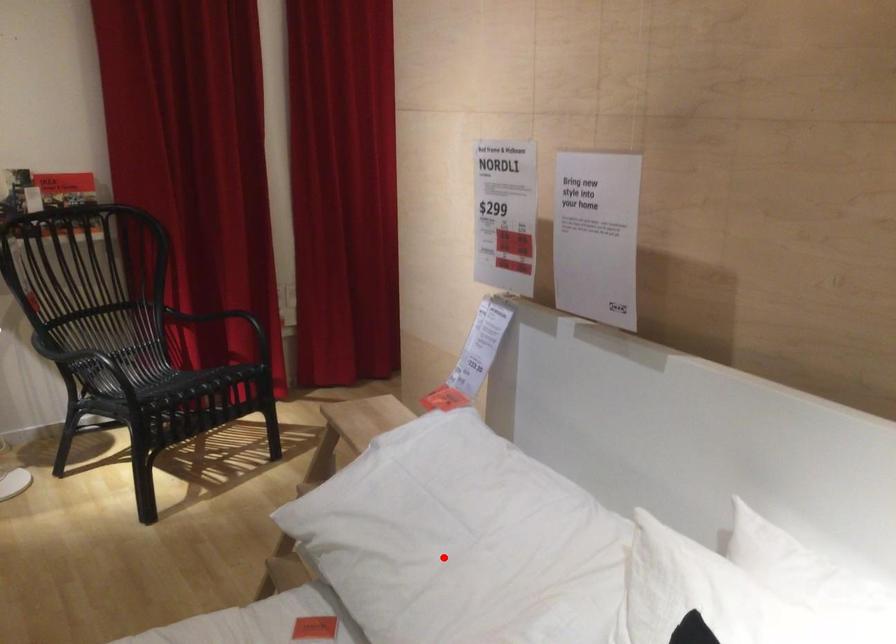
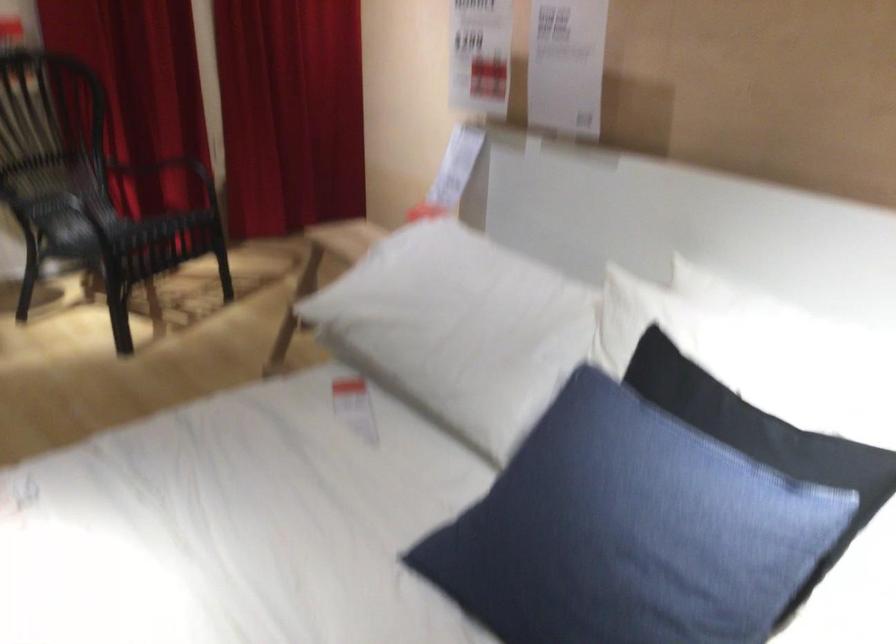
Find the pixel in the second image that matches the highlighted location in the first image.

(455, 321)